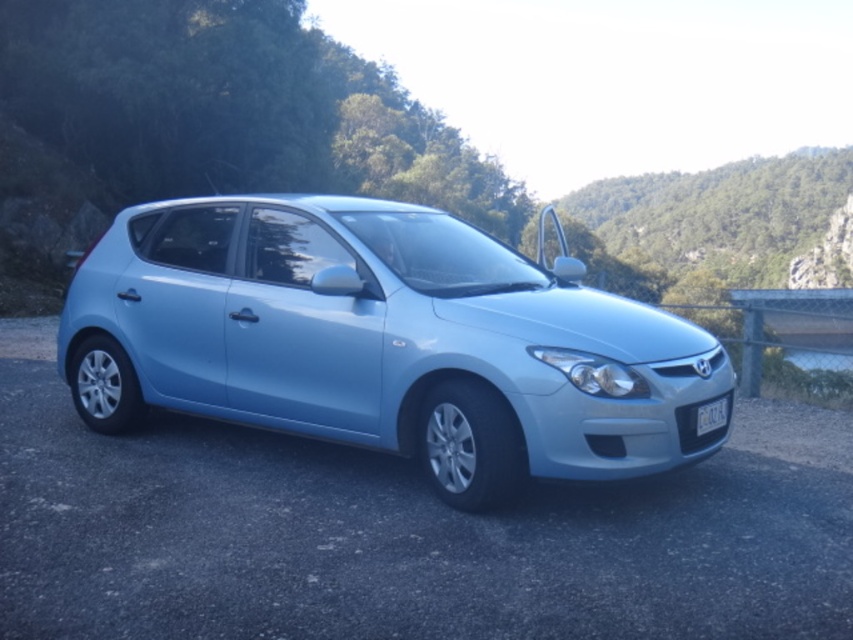
You are a photographer trying to capture the entire white plastic license plate at center in your shot without cropping it. Given that the satin light blue car at center is much taller than the license plate, would you need to adjust your camera angle upwards or downwards to ensure the license plate is fully visible?

Since the satin light blue car at center is much taller than the white plastic license plate at center, you would need to adjust your camera angle downwards to ensure the license plate is fully visible without cropping.

You are standing at the point with coordinates point (383, 340). You want to get to the car. Is the car in front of you or behind you?

The point (383, 340) is on the satin light blue car at center, so the car is right where you are standing. You are already on the car.

You are a driver who wants to read the license plate of the satin light blue car at center. Since the license plate is white plastic license plate at center, where should you look relative to the car?

The satin light blue car at center is above the white plastic license plate at center, so you should look below the car to find the license plate.